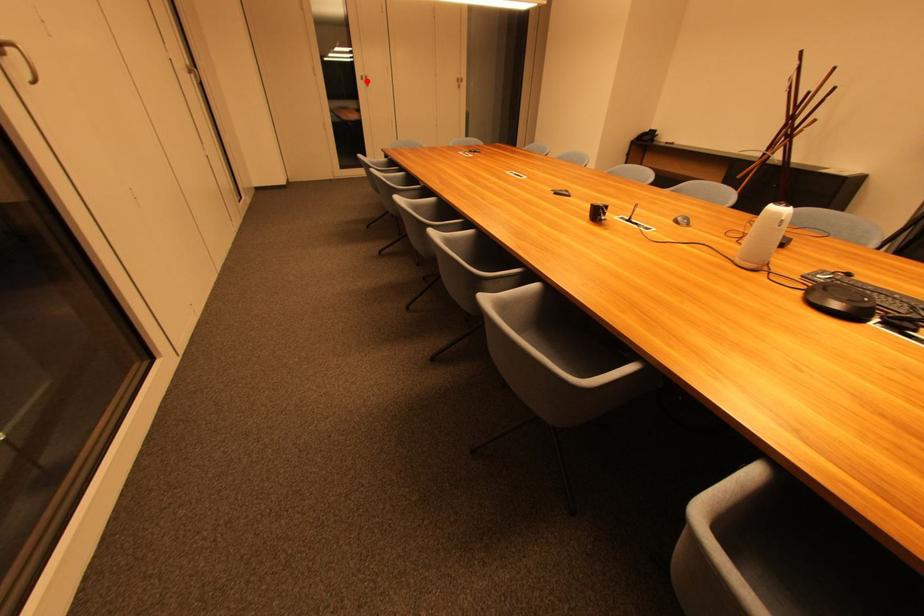
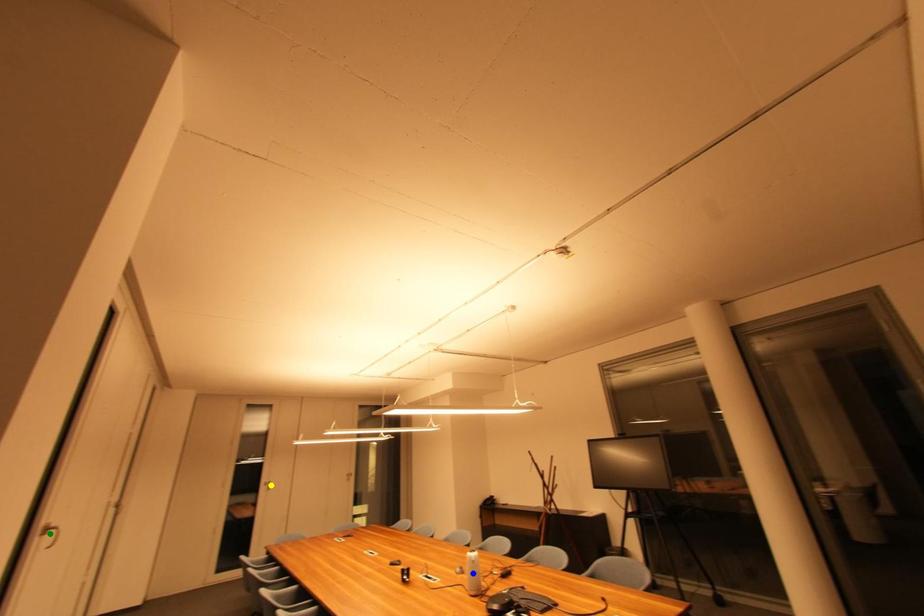
Question: I am providing you with two images of the same scene from different viewpoints. A red point is marked on the first image. You are given multiple points on the second image. Which point in image 2 is actually the same real-world point as the red point in image 1?

Choices:
 (A) yellow point
 (B) green point
 (C) blue point

Answer: (A)